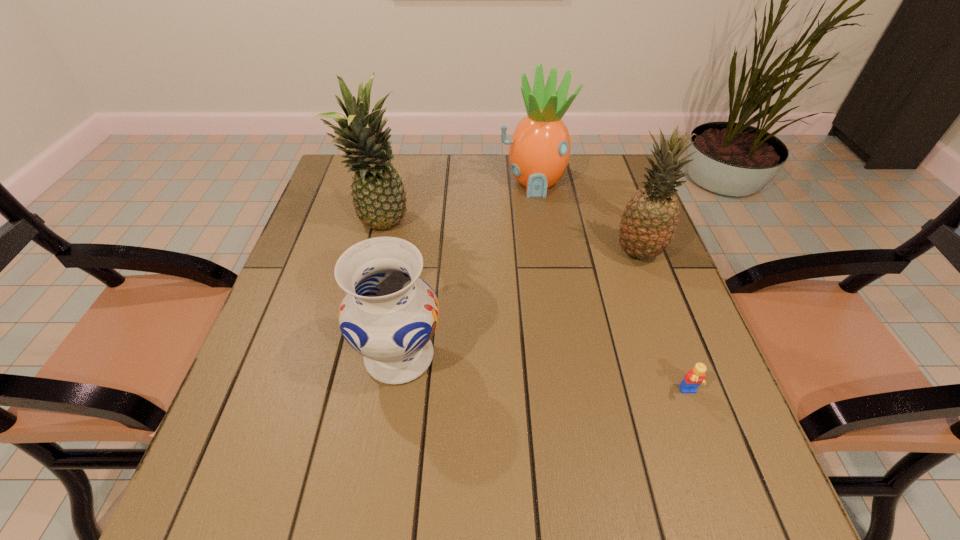
Where is `vacant area situated 0.060m on the face of the Lego`? Image resolution: width=960 pixels, height=540 pixels. vacant area situated 0.060m on the face of the Lego is located at coordinates (704, 431).

This screenshot has height=540, width=960. Identify the location of object located at the far edge. (539, 151).

Identify the location of object located in the left edge section of the desktop. (379, 198).

The height and width of the screenshot is (540, 960). I want to click on pineapple present at the right edge, so click(x=650, y=218).

Locate an element on the screen. The image size is (960, 540). Lego that is at the right edge is located at coordinates (695, 377).

This screenshot has width=960, height=540. In the image, there is a desktop. Find the location of `free space at the far edge`. free space at the far edge is located at coordinates (433, 167).

You are a GUI agent. You are given a task and a screenshot of the screen. Output one action in this format:
    pyautogui.click(x=<x>, y=<y>)
    Task: Click on the vacant space at the near edge
    Image resolution: width=960 pixels, height=540 pixels.
    Given the screenshot: What is the action you would take?
    pyautogui.click(x=330, y=492)

This screenshot has width=960, height=540. Identify the location of vacant point at the left edge. (295, 259).

Locate an element on the screen. This screenshot has height=540, width=960. free region at the right edge of the desktop is located at coordinates (645, 302).

This screenshot has height=540, width=960. Find the location of `free region at the far left corner of the desktop`. free region at the far left corner of the desktop is located at coordinates (338, 192).